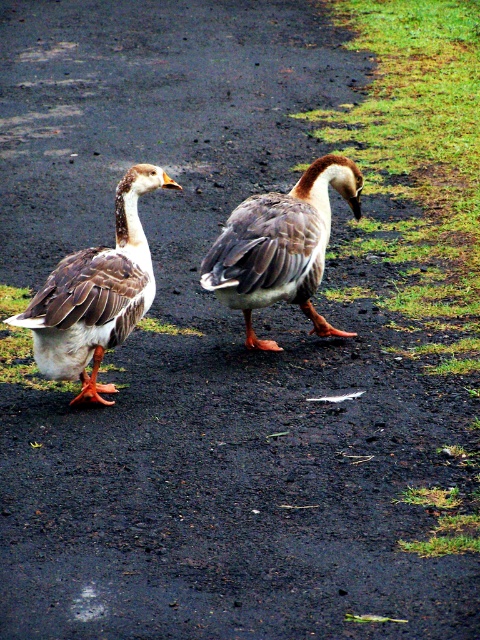
From the picture: Is the position of speckled feathered duck at left less distant than that of brown speckled feathers at center?

That is True.

Between speckled feathered duck at left and brown speckled feathers at center, which one has less height?

brown speckled feathers at center

Which is in front, point (61, 275) or point (259, 244)?

Point (61, 275) is in front.

Where is `speckled feathered duck at left`? The height and width of the screenshot is (640, 480). speckled feathered duck at left is located at coordinates (96, 294).